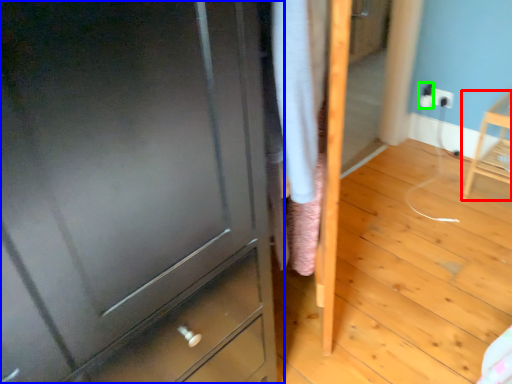
Question: Which object is positioned farthest from furniture (highlighted by a red box)? Select from chest of drawers (highlighted by a blue box) and electric outlet (highlighted by a green box).

Choices:
 (A) chest of drawers
 (B) electric outlet

Answer: (A)